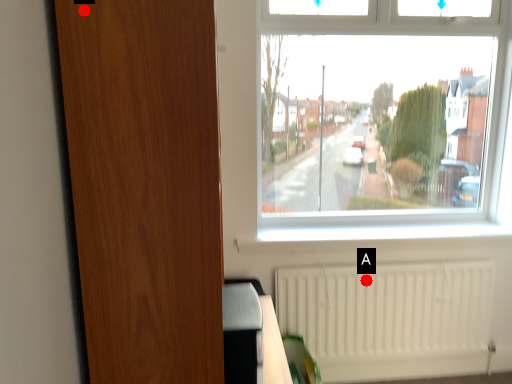
Question: Two points are circled on the image, labeled by A and B beside each circle. Which point appears closest to the camera in this image?

Choices:
 (A) A is closer
 (B) B is closer

Answer: (B)